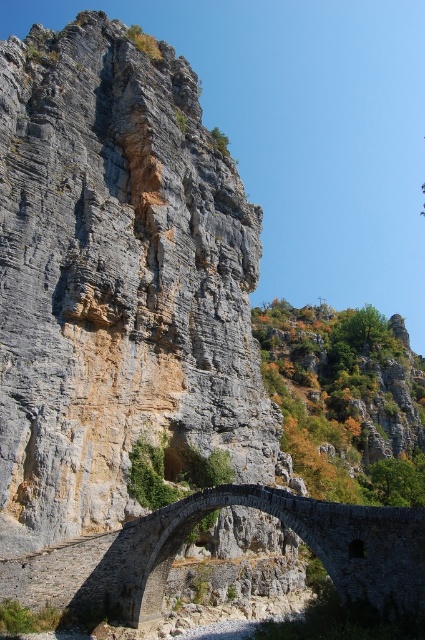
Does dark gray stone bridge at center have a lesser width compared to green leafy hillside at center?

Indeed, dark gray stone bridge at center has a lesser width compared to green leafy hillside at center.

From the picture: Is dark gray stone bridge at center above green leafy hillside at center?

No, dark gray stone bridge at center is not above green leafy hillside at center.

Which is behind, point (354, 518) or point (407, 420)?

The point (407, 420) is behind.

Identify the location of dark gray stone bridge at center. (195, 524).